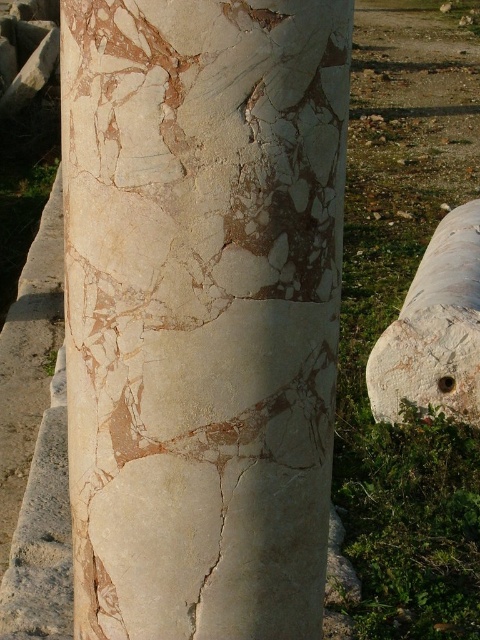
You are an archaeologist examining the marble column. You notice two points marked on the column surface at coordinates point (255,256) and point (439,250). Which point is positioned closer to your viewpoint?

Point (255,256) is closer to the viewer than point (439,250).